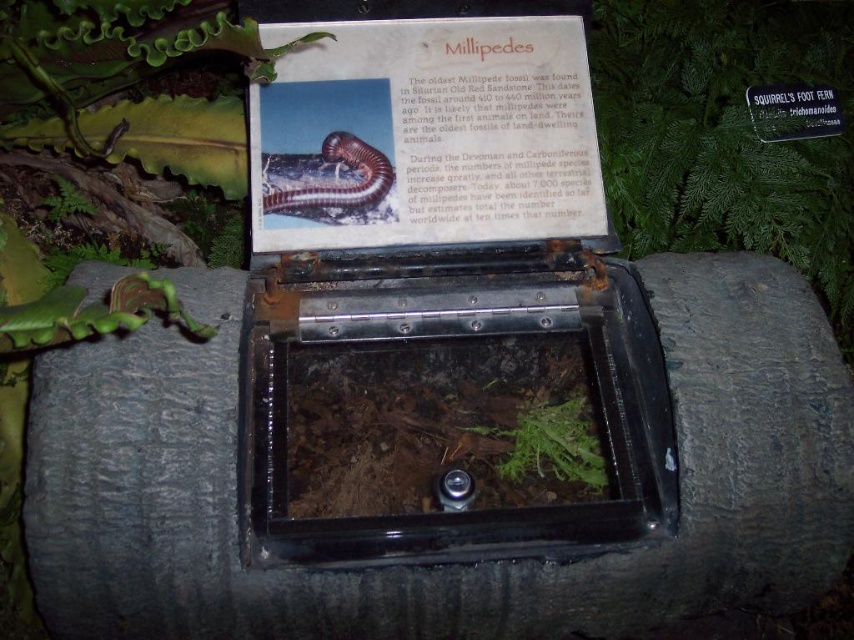
Question: In this image, where is green leafy fern at upper center located relative to green leafy plant at center?

Choices:
 (A) left
 (B) right

Answer: (B)

Question: Considering the real-world distances, which object is closest to the green leafy fern at upper center?

Choices:
 (A) green leafy plant at center
 (B) green leafy plant at lower left

Answer: (A)

Question: Which object appears closest to the camera in this image?

Choices:
 (A) green leafy plant at lower left
 (B) green leafy fern at upper center

Answer: (B)

Question: Is green leafy fern at upper center smaller than green leafy plant at lower left?

Choices:
 (A) yes
 (B) no

Answer: (B)

Question: Estimate the real-world distances between objects in this image. Which object is farther from the green leafy fern at upper center?

Choices:
 (A) green leafy plant at lower left
 (B) green leafy plant at center

Answer: (A)

Question: Is green leafy fern at upper center to the left of green leafy plant at center from the viewer's perspective?

Choices:
 (A) no
 (B) yes

Answer: (A)